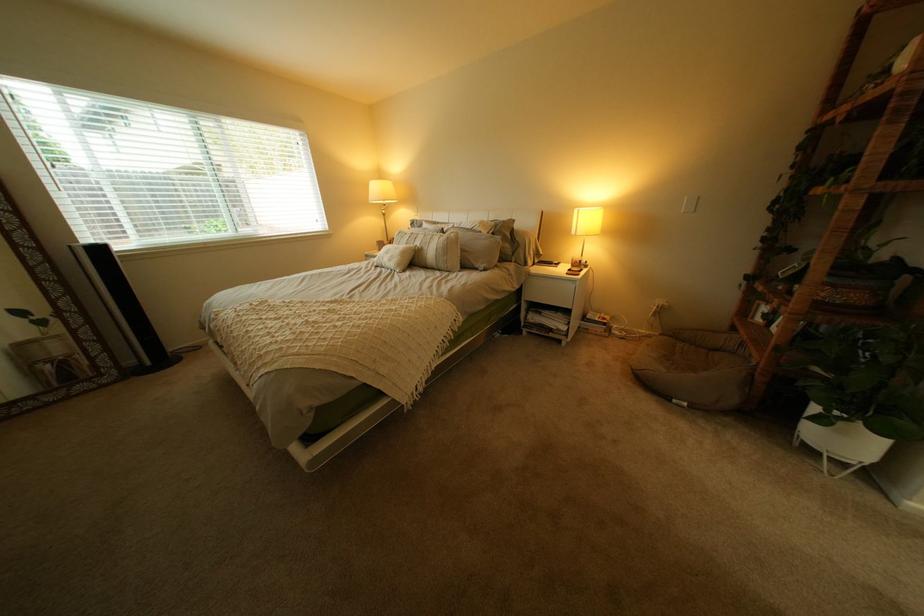
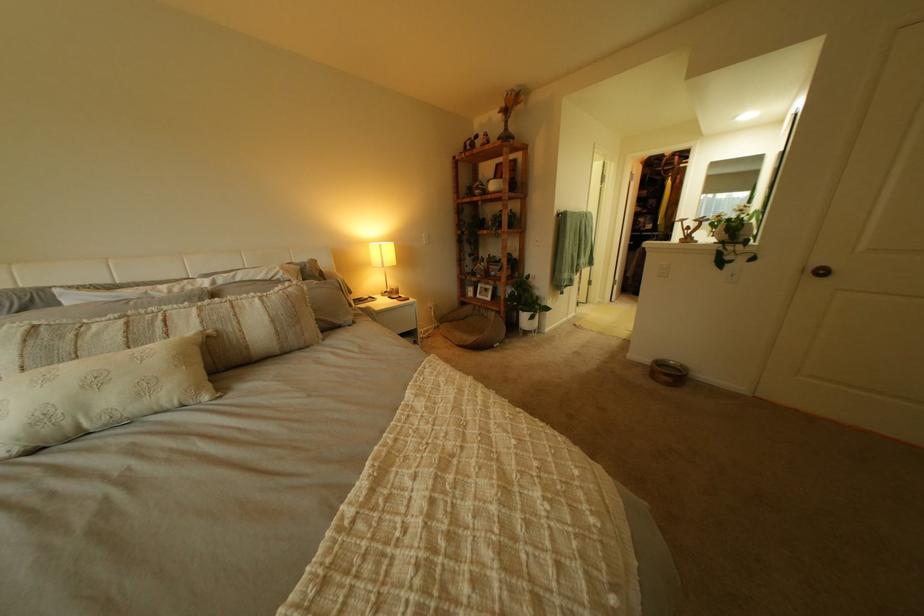
In the second image, find the point that corresponds to the point at 774,371 in the first image.

(517, 314)